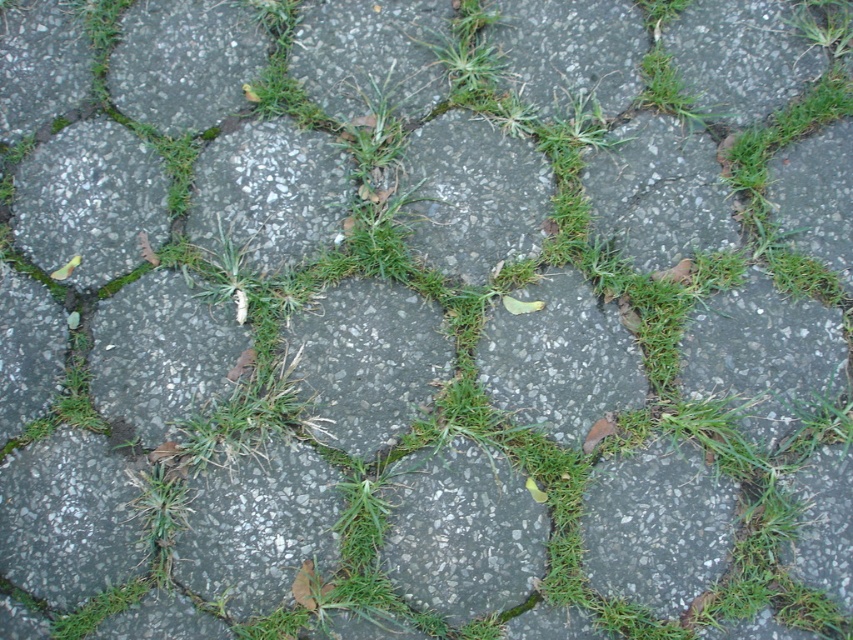
Question: Which point appears closest to the camera in this image?

Choices:
 (A) (252, 232)
 (B) (438, 369)
 (C) (53, 188)
 (D) (128, 20)

Answer: (B)

Question: Does gray rough stone at center have a lesser width compared to speckled concrete stone at center?

Choices:
 (A) yes
 (B) no

Answer: (A)

Question: Is gray concrete hexagon at upper left smaller than speckled concrete stone at center?

Choices:
 (A) no
 (B) yes

Answer: (A)

Question: Which of the following is the closest to the observer?

Choices:
 (A) (451, 132)
 (B) (164, 180)
 (C) (230, 84)

Answer: (B)

Question: Which is nearer to the gray concrete hexagon at upper left?

Choices:
 (A) speckled concrete stone at center
 (B) gray concrete stone at center
 (C) gray speckled stone at upper left

Answer: (C)

Question: Does gray concrete hexagon at upper left have a greater width compared to gray rough stone at center?

Choices:
 (A) no
 (B) yes

Answer: (B)